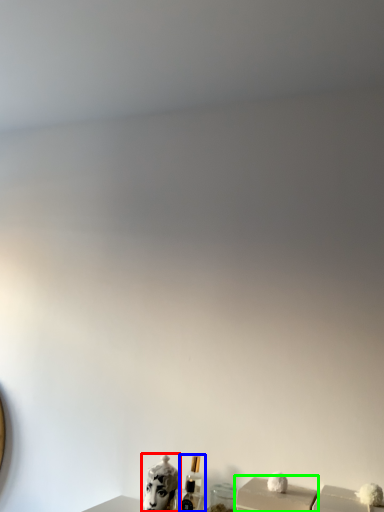
Question: Estimate the real-world distances between objects in this image. Which object is farther from animal (highlighted by a red box), perfume (highlighted by a blue box) or box (highlighted by a green box)?

Choices:
 (A) perfume
 (B) box

Answer: (B)